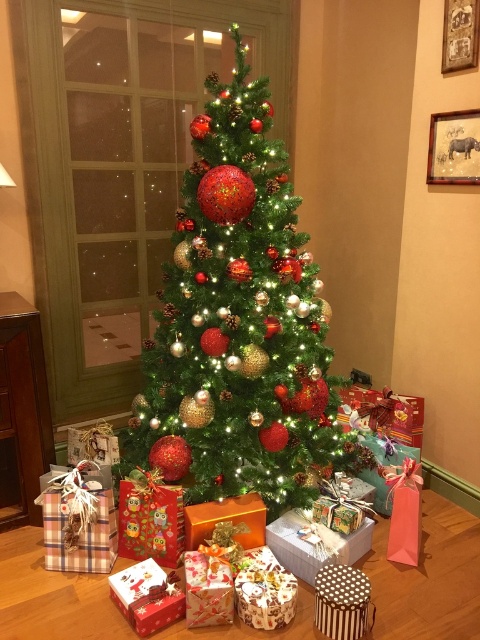
You are standing in front of the Christmas tree and want to place a gift at point (126,579) and another gift at point (228,500). Which gift will be closer to you?

The gift placed at point (126,579) will be closer to you because point (126,579) is in front of point (228,500).

You are a guest at a Christmas party and you see the shiny metallic tree at center and the gold shiny gift at center. Which object is larger?

The shiny metallic tree at center is bigger than the gold shiny gift at center.